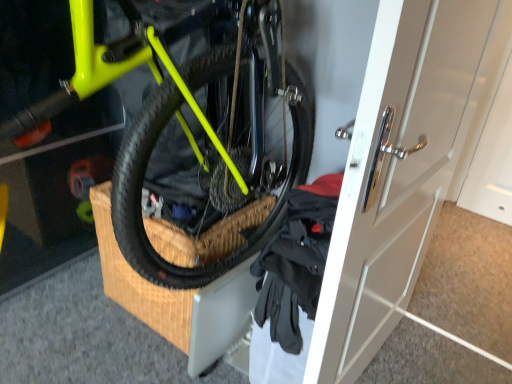
Question: From a real-world perspective, is white glossy door at center physically above neon yellow matte bicycle at center?

Choices:
 (A) yes
 (B) no

Answer: (B)

Question: Can you confirm if white glossy door at center is thinner than neon yellow matte bicycle at center?

Choices:
 (A) no
 (B) yes

Answer: (B)

Question: Is white glossy door at center to the left of neon yellow matte bicycle at center from the viewer's perspective?

Choices:
 (A) no
 (B) yes

Answer: (A)

Question: From a real-world perspective, is white glossy door at center beneath neon yellow matte bicycle at center?

Choices:
 (A) yes
 (B) no

Answer: (A)

Question: Is white glossy door at center shorter than neon yellow matte bicycle at center?

Choices:
 (A) yes
 (B) no

Answer: (B)

Question: Is white glossy door at center wider than neon yellow matte bicycle at center?

Choices:
 (A) no
 (B) yes

Answer: (A)

Question: From the image's perspective, does black fabric gloves at lower right appear lower than white glossy door at center?

Choices:
 (A) yes
 (B) no

Answer: (A)

Question: Is white glossy door at center at the back of black fabric gloves at lower right?

Choices:
 (A) no
 (B) yes

Answer: (A)

Question: Could you tell me if black fabric gloves at lower right is turned towards white glossy door at center?

Choices:
 (A) no
 (B) yes

Answer: (A)

Question: Is black fabric gloves at lower right shorter than white glossy door at center?

Choices:
 (A) yes
 (B) no

Answer: (A)

Question: Is black fabric gloves at lower right smaller than white glossy door at center?

Choices:
 (A) yes
 (B) no

Answer: (A)

Question: Considering the relative sizes of black fabric gloves at lower right and white glossy door at center in the image provided, is black fabric gloves at lower right bigger than white glossy door at center?

Choices:
 (A) no
 (B) yes

Answer: (A)

Question: Is neon yellow matte bicycle at center wider than black fabric gloves at lower right?

Choices:
 (A) yes
 (B) no

Answer: (A)